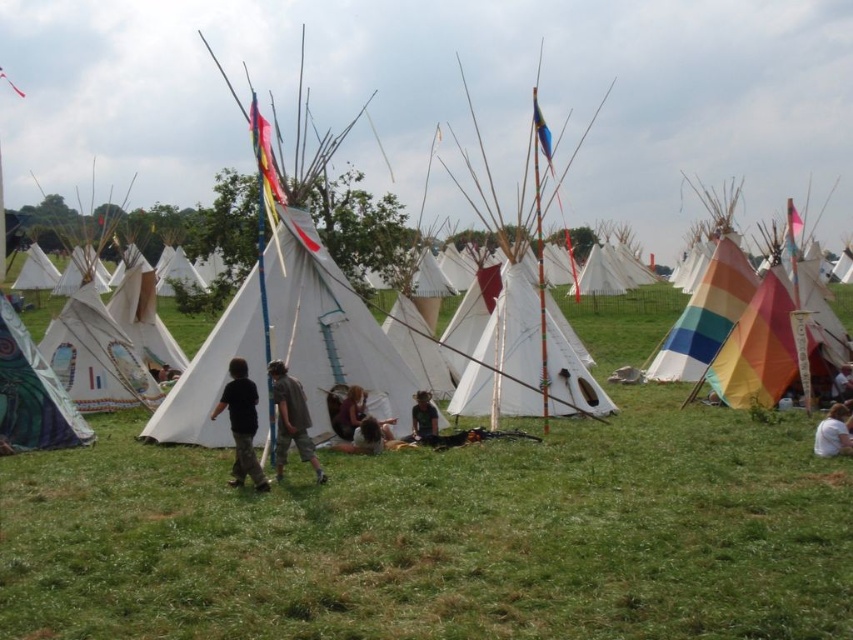
Question: Can you confirm if black cotton shirt at center is positioned below dark green fabric at center?

Choices:
 (A) no
 (B) yes

Answer: (A)

Question: From the image, what is the correct spatial relationship of brown cotton shorts at center in relation to white cotton shirt at lower right?

Choices:
 (A) below
 (B) above

Answer: (B)

Question: Does green fabric tent at lower left come behind brown cotton shorts at center?

Choices:
 (A) no
 (B) yes

Answer: (B)

Question: Which object is farther from the camera taking this photo?

Choices:
 (A) green grass at center
 (B) green fabric tent at lower left

Answer: (B)

Question: Which object is the closest to the black cotton shirt at center?

Choices:
 (A) green fabric tent at lower left
 (B) white cotton shirt at lower right

Answer: (A)

Question: Which of the following is the closest to the observer?

Choices:
 (A) (239, 476)
 (B) (190, 385)
 (C) (838, 417)

Answer: (A)